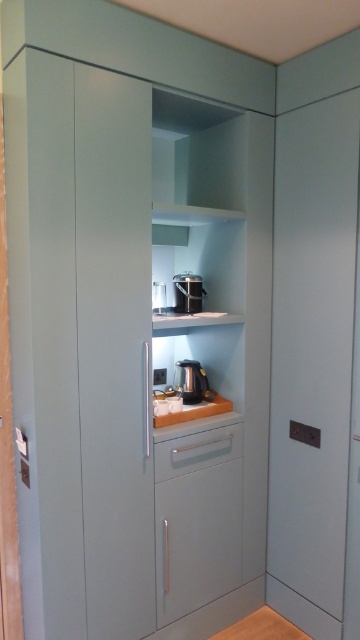
Question: Which of the following is the closest to the observer?

Choices:
 (A) satin black coffee machine at center
 (B) orange matte counter top at center
 (C) satin black coffee maker at center

Answer: (B)

Question: Estimate the real-world distances between objects in this image. Which object is closer to the matte gray drawer at center?

Choices:
 (A) orange matte counter top at center
 (B) satin black coffee maker at center
 (C) matte black coffee maker at center

Answer: (A)

Question: Does matte gray drawer at center appear under satin black coffee machine at center?

Choices:
 (A) yes
 (B) no

Answer: (A)

Question: Considering the real-world distances, which object is closest to the orange matte counter top at center?

Choices:
 (A) matte black coffee maker at center
 (B) satin black coffee maker at center

Answer: (B)

Question: Is matte gray drawer at center to the right of satin black coffee machine at center from the viewer's perspective?

Choices:
 (A) yes
 (B) no

Answer: (A)

Question: Is matte gray drawer at center bigger than orange matte counter top at center?

Choices:
 (A) yes
 (B) no

Answer: (A)